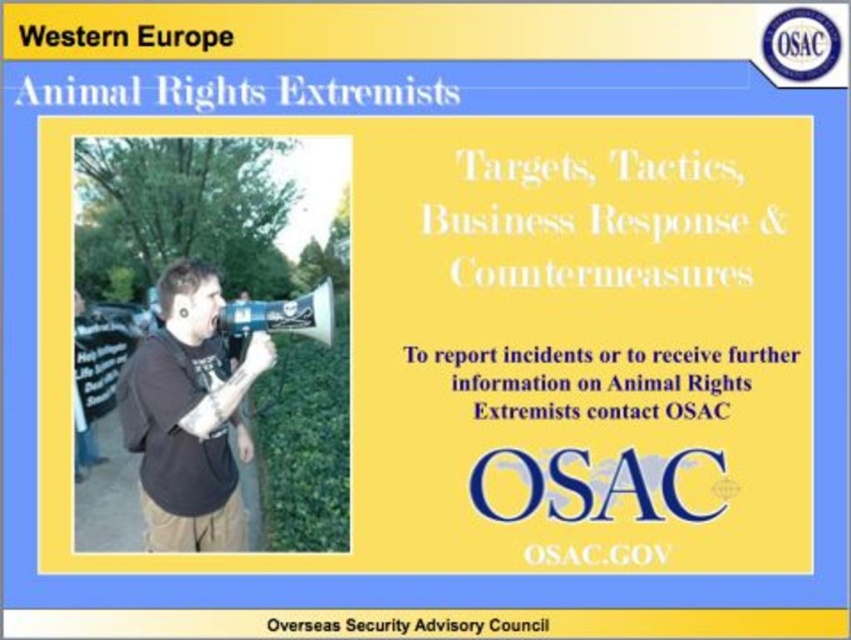
You are standing in front of the slide and want to point to the black matte megaphone at center. What are the coordinates of its position?

The coordinates of the black matte megaphone at center are at point (189, 416).

From the picture: You are an event organizer setting up a stage for a public speech. You have two megaphones on the stage, a black matte megaphone at center and a blue plastic megaphone at center. You need to place a banner between them. What is the minimum distance in inches you should leave between the two megaphones to ensure the banner fits?

The black matte megaphone at center and blue plastic megaphone at center are 15.26 inches apart from each other. Therefore, the minimum distance you should leave between them is at least 15.26 inches to accommodate the banner.